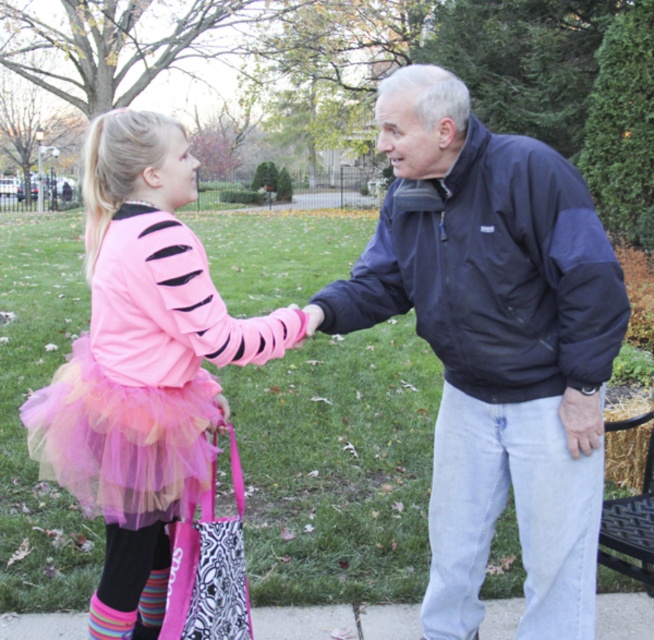
You are a photographer taking a picture of two points in the scene. Which point, point (56, 472) or point (230, 561), appears closer to the camera in the image?

Point (56, 472) is closer to the camera than point (230, 561).

You are standing at the point marked by coordinates point (x=494, y=344) in the image. What object is directly in front of you?

The point (x=494, y=344) marks the navy blue jacket at center, so the object directly in front of you is the navy blue jacket at center.